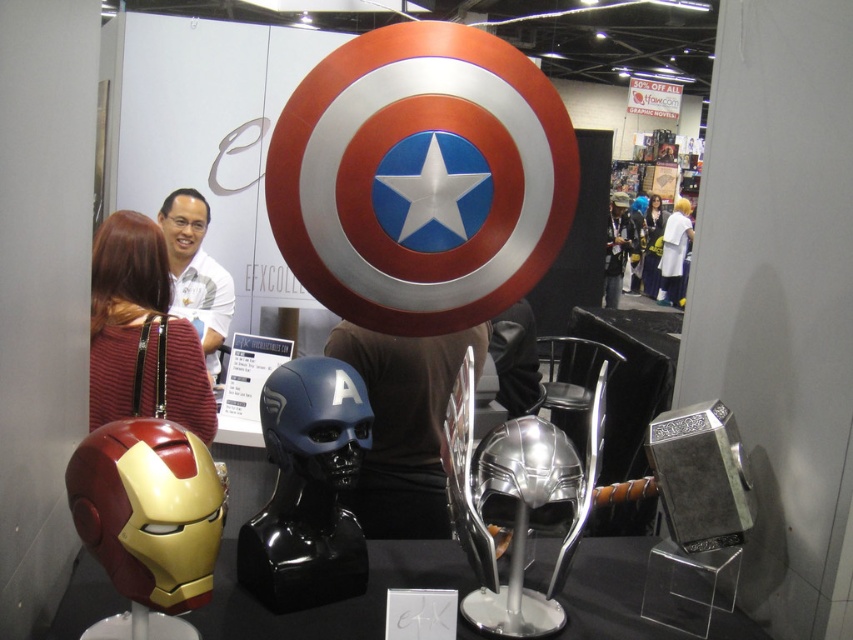
You are at a comic book convention and want to take a photo with the silver metallic helmet at center and the maroon striped sweater at left. Which object is narrower when viewed from the front?

The silver metallic helmet at center is thinner than the maroon striped sweater at left, so it is narrower when viewed from the front.

You are an event organizer at the convention and need to place a new display stand that requires 1.2 meters of space. You want to place it between the metallic silver helmet at lower center and the glossy blue helmet at center. Is there enough space between them to accommodate the stand?

The metallic silver helmet at lower center has a larger size compared to glossy blue helmet at center, but the distance between them isn not specified in the objects description. Therefore, it is unclear if there is enough space to place the new display stand between them.

You are a photographer at the exhibition and want to ensure both the white matte shirt at upper center and the silky black hair at upper center are clearly visible in your photo. Given their sizes, which one might you need to adjust your camera focus on more carefully to avoid blurriness?

The white matte shirt at upper center occupies less space than the silky black hair at upper center, so you might need to focus more carefully on the white matte shirt at upper center to ensure it is not too small or blurry in the photo.